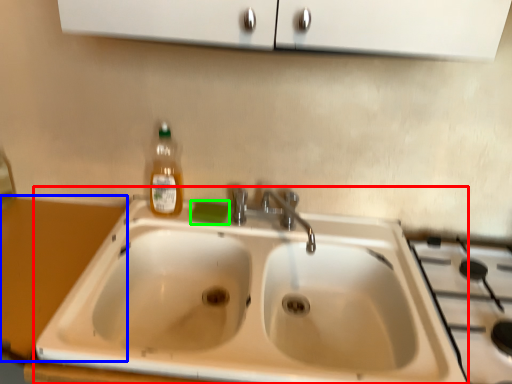
Question: Estimate the real-world distances between objects in this image. Which object is closer to sink (highlighted by a red box), counter top (highlighted by a blue box) or soap (highlighted by a green box)?

Choices:
 (A) counter top
 (B) soap

Answer: (B)